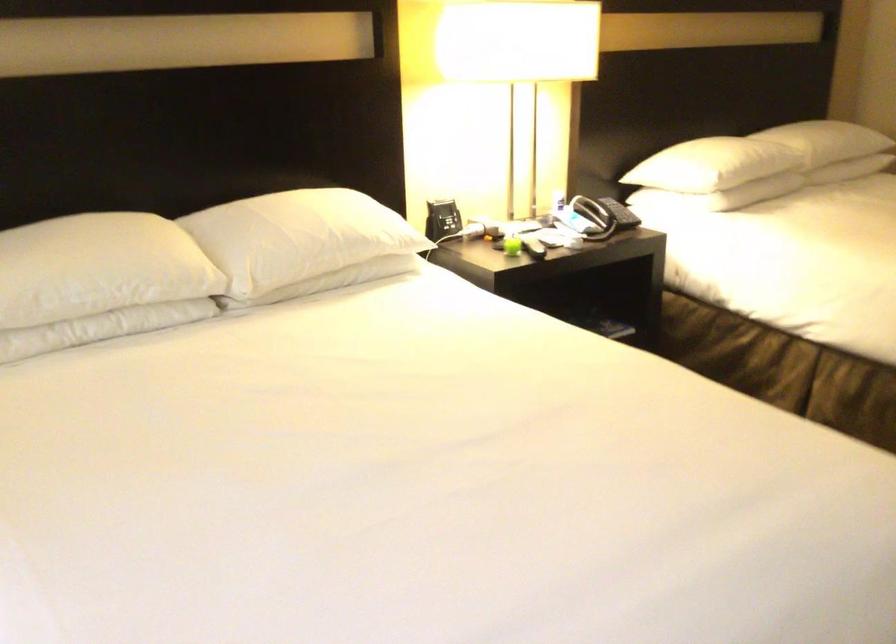
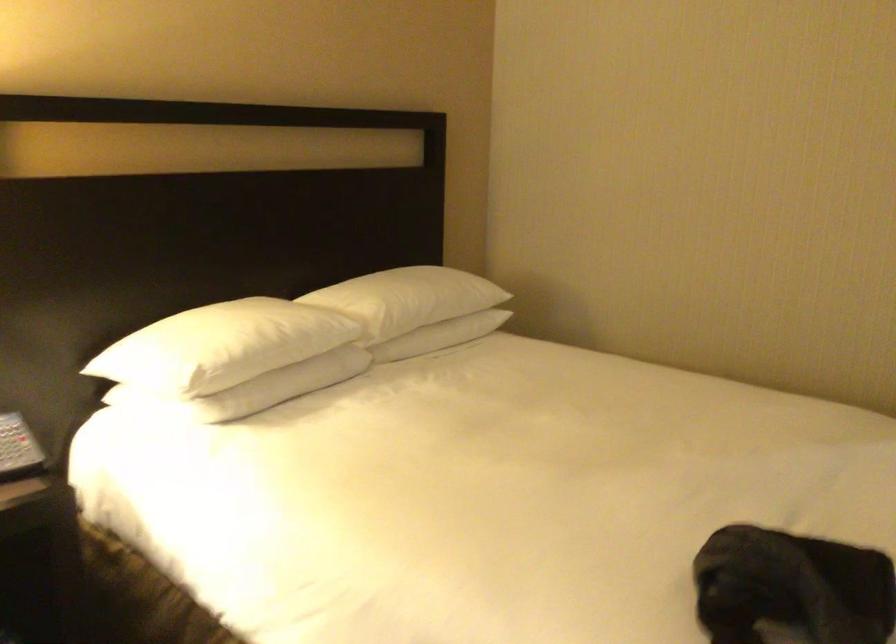
Which direction would the cameraman need to move to produce the second image?

The movement direction of the cameraman is right, forward.